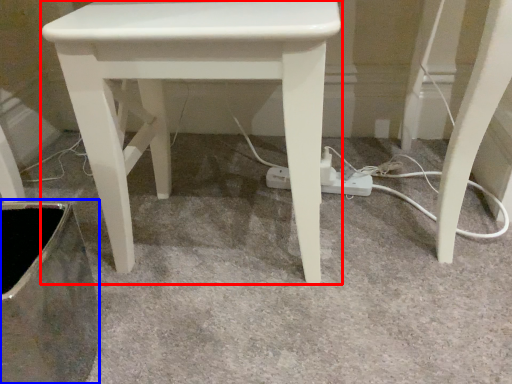
Question: Which point is closer to the camera, stool (highlighted by a red box) or swivel chair (highlighted by a blue box)?

Choices:
 (A) stool
 (B) swivel chair

Answer: (B)